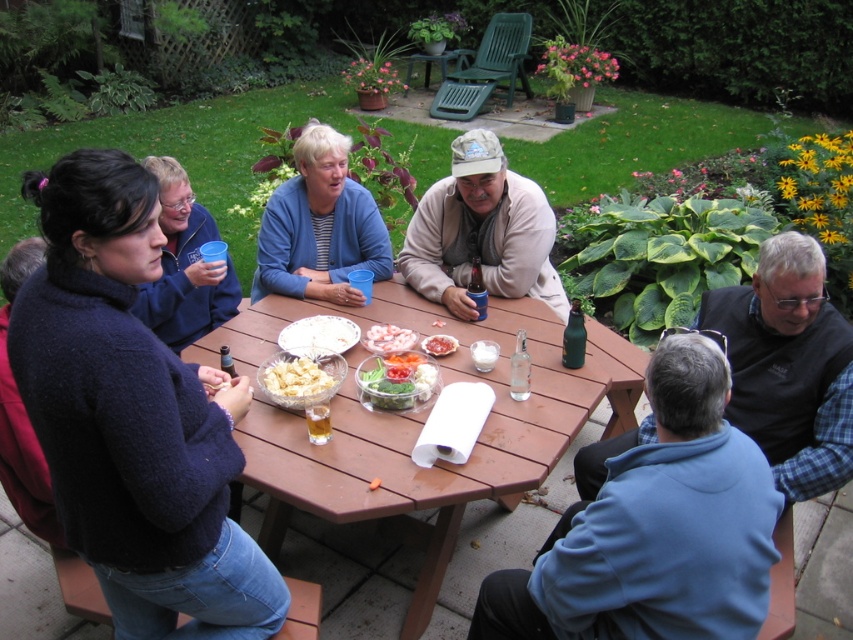
Question: Which object is the farthest from the white paper plate at center?

Choices:
 (A) black sweater at lower right
 (B) blue fleece jacket at center

Answer: (A)

Question: Is brown wooden table at center in front of blue plastic cup at upper left?

Choices:
 (A) yes
 (B) no

Answer: (A)

Question: Is blue fleece jacket at center to the right of white paper plate at center from the viewer's perspective?

Choices:
 (A) yes
 (B) no

Answer: (B)

Question: Among these objects, which one is farthest from the camera?

Choices:
 (A) dark blue fleece at upper left
 (B) blue fleece jacket at center
 (C) shiny plastic container of salad at center

Answer: (B)

Question: Is shiny plastic container of salad at center wider than sliced raw meat at center?

Choices:
 (A) yes
 (B) no

Answer: (A)

Question: Which object is closer to the camera taking this photo?

Choices:
 (A) blue plastic cup at upper left
 (B) blue fleece jacket at center

Answer: (A)